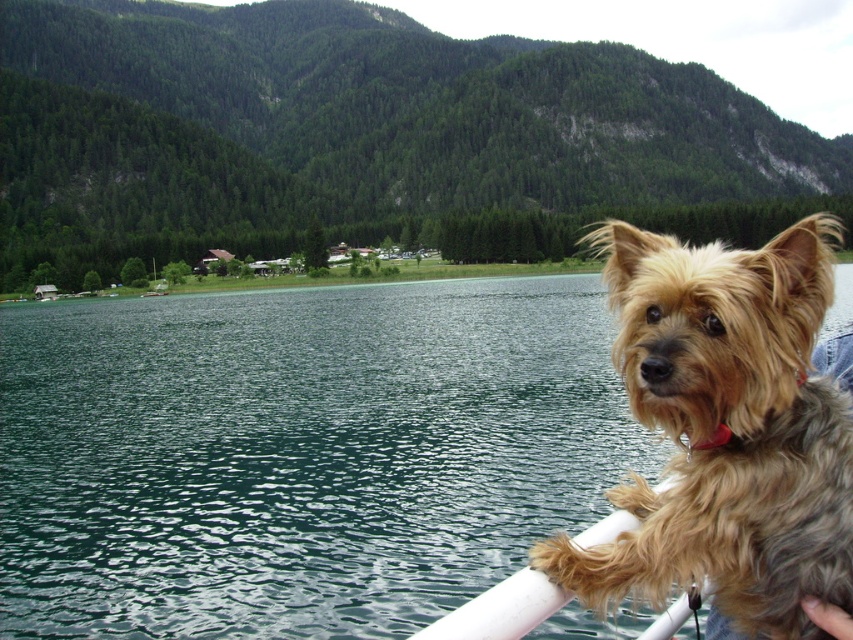
Question: Can you confirm if green water at lower left is bigger than golden fur dog at right?

Choices:
 (A) yes
 (B) no

Answer: (A)

Question: Which object is closer to the camera taking this photo?

Choices:
 (A) green water at lower left
 (B) golden fur dog at right

Answer: (B)

Question: Can you confirm if green water at lower left is positioned to the left of golden fur dog at right?

Choices:
 (A) no
 (B) yes

Answer: (B)

Question: Which point is closer to the camera taking this photo?

Choices:
 (A) (287, 636)
 (B) (715, 294)

Answer: (B)

Question: Does green water at lower left appear under golden fur dog at right?

Choices:
 (A) no
 (B) yes

Answer: (A)